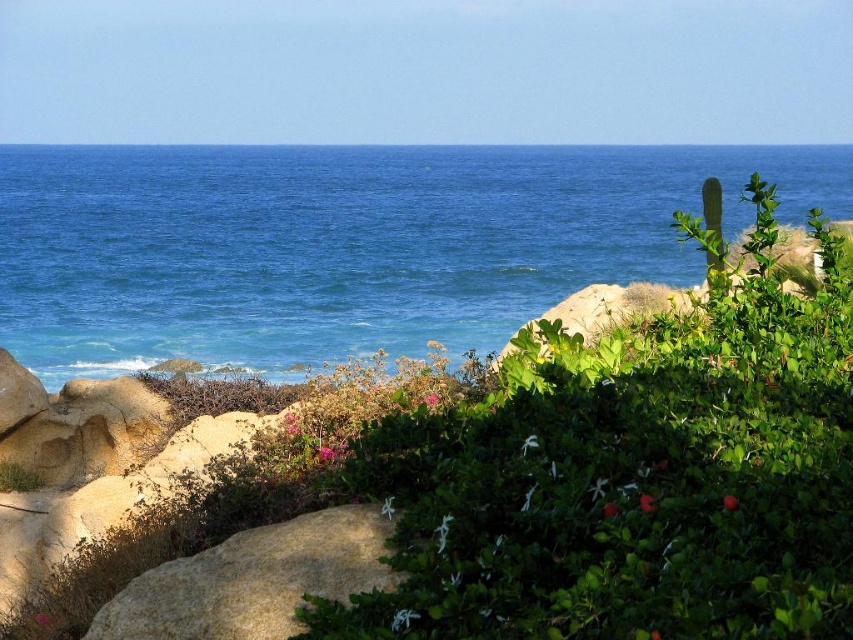
Question: Is blue liquid water at upper center in front of smooth beige rock at lower left?

Choices:
 (A) no
 (B) yes

Answer: (A)

Question: Which point is closer to the camera?

Choices:
 (A) (451, 632)
 (B) (260, 218)
 (C) (254, 550)

Answer: (A)

Question: Does blue liquid water at upper center appear under smooth beige rock at lower left?

Choices:
 (A) no
 (B) yes

Answer: (A)

Question: Among these objects, which one is farthest from the camera?

Choices:
 (A) smooth beige rock at lower left
 (B) blue liquid water at upper center

Answer: (B)

Question: In this image, where is green leafy bush at center located relative to blue liquid water at upper center?

Choices:
 (A) below
 (B) above

Answer: (A)

Question: Considering the real-world distances, which object is closest to the green leafy bush at center?

Choices:
 (A) blue liquid water at upper center
 (B) smooth beige rock at lower left

Answer: (B)